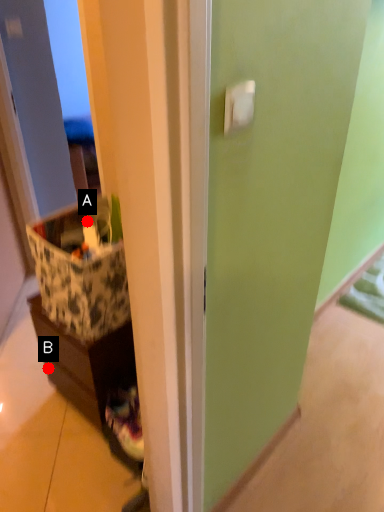
Question: Two points are circled on the image, labeled by A and B beside each circle. Which point is farther to the camera?

Choices:
 (A) A is further
 (B) B is further

Answer: (B)